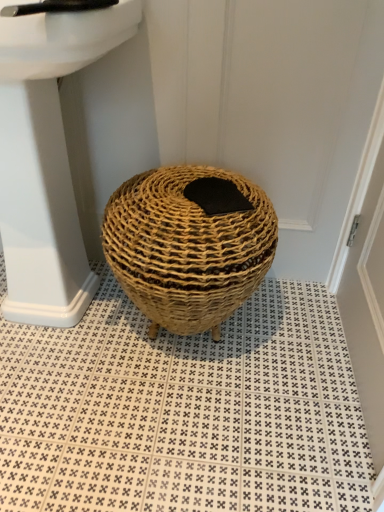
Locate an element on the screen. vacant area that is in front of black felt pad at center is located at coordinates (205, 223).